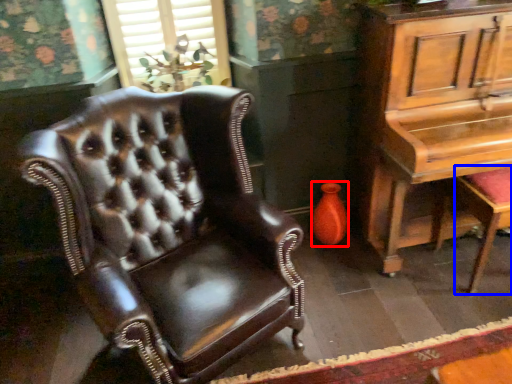
Question: Which point is closer to the camera, vase (highlighted by a red box) or music stool (highlighted by a blue box)?

Choices:
 (A) vase
 (B) music stool

Answer: (B)